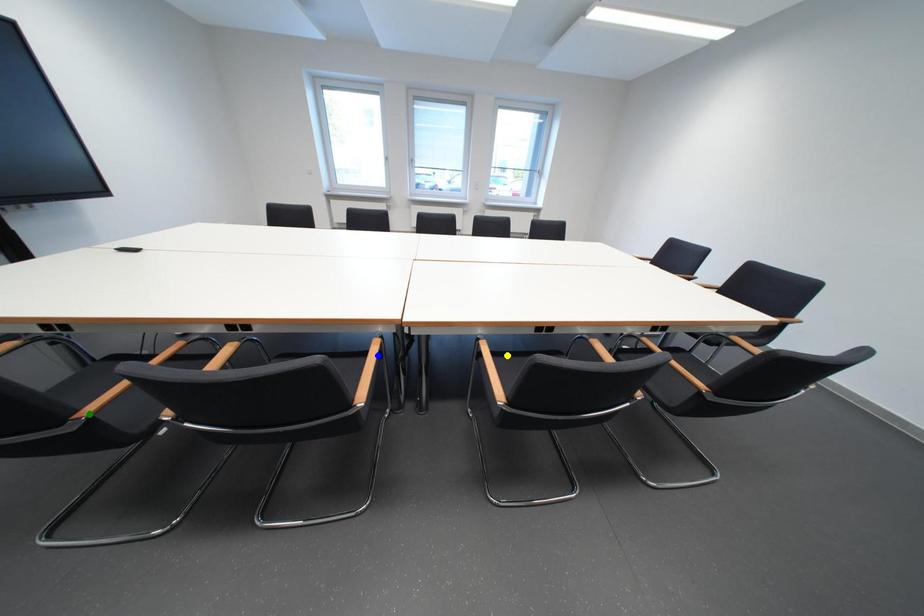
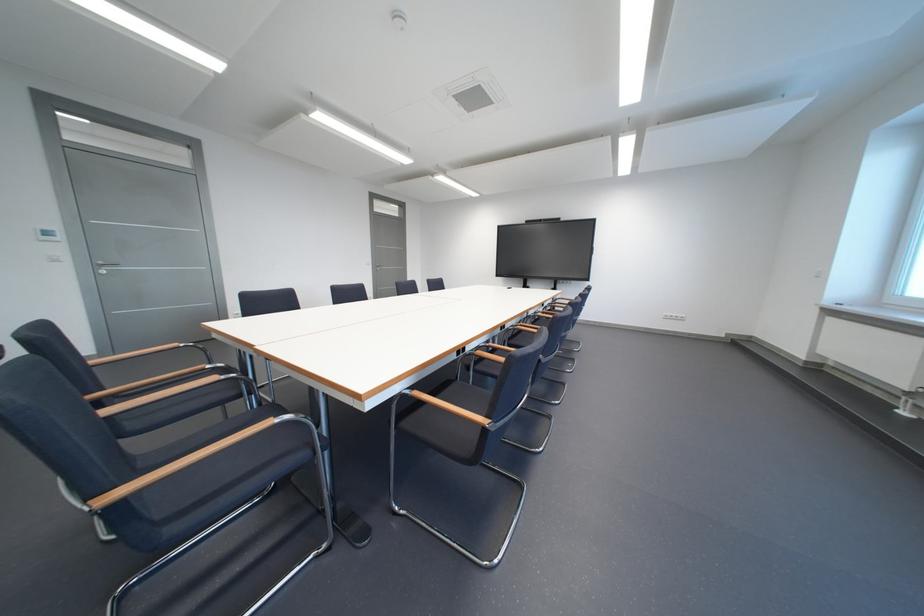
I am providing you with two images of the same scene from different viewpoints. Three points are marked in image1. Which point corresponds to a part or object that is occluded in image2?In image1, three points are marked. Which of them correspond to a part or object that is occluded in image2?Among the three points shown in image1, which one corresponds to a part or object that is no longer visible due to occlusion in image2?

Invisible in image2: blue point, green point, yellow point.